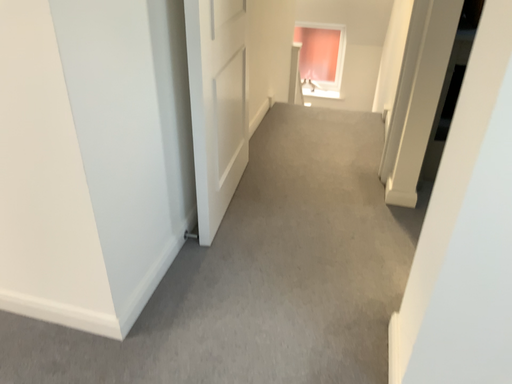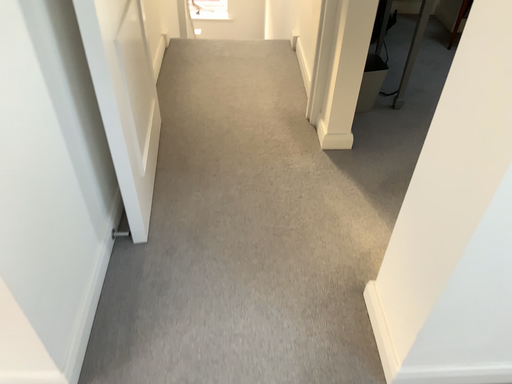
Question: Which way did the camera rotate in the video?

Choices:
 (A) rotated right
 (B) rotated left

Answer: (A)